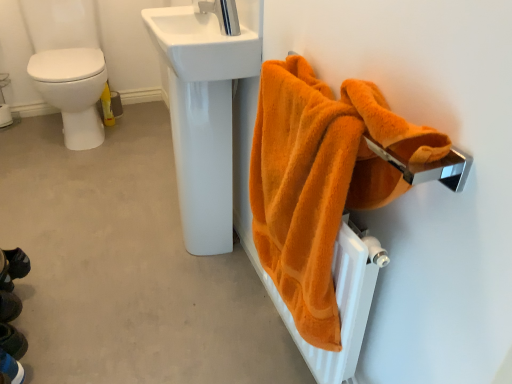
Question: Does silver metallic tap at upper center have a greater width compared to white glossy sink at upper center?

Choices:
 (A) no
 (B) yes

Answer: (A)

Question: Can you confirm if silver metallic tap at upper center is smaller than white glossy sink at upper center?

Choices:
 (A) no
 (B) yes

Answer: (B)

Question: Does silver metallic tap at upper center contain white glossy sink at upper center?

Choices:
 (A) no
 (B) yes

Answer: (A)

Question: Is silver metallic tap at upper center looking in the opposite direction of white glossy sink at upper center?

Choices:
 (A) yes
 (B) no

Answer: (B)

Question: From a real-world perspective, is silver metallic tap at upper center below white glossy sink at upper center?

Choices:
 (A) no
 (B) yes

Answer: (A)

Question: Is silver metallic tap at upper center next to white glossy sink at upper center?

Choices:
 (A) yes
 (B) no

Answer: (B)

Question: Can you confirm if white leather shoe at lower left is bigger than dark blue fabric shoes at lower left?

Choices:
 (A) yes
 (B) no

Answer: (B)

Question: Is white leather shoe at lower left taller than dark blue fabric shoes at lower left?

Choices:
 (A) no
 (B) yes

Answer: (A)

Question: Does white leather shoe at lower left have a lesser width compared to dark blue fabric shoes at lower left?

Choices:
 (A) no
 (B) yes

Answer: (B)

Question: From a real-world perspective, does white leather shoe at lower left sit lower than dark blue fabric shoes at lower left?

Choices:
 (A) no
 (B) yes

Answer: (B)

Question: From a real-world perspective, is white leather shoe at lower left on top of dark blue fabric shoes at lower left?

Choices:
 (A) no
 (B) yes

Answer: (A)

Question: Is white leather shoe at lower left further to the viewer compared to dark blue fabric shoes at lower left?

Choices:
 (A) yes
 (B) no

Answer: (B)

Question: Could you tell me if orange fluffy towel at right is facing dark blue fabric shoes at lower left?

Choices:
 (A) yes
 (B) no

Answer: (A)